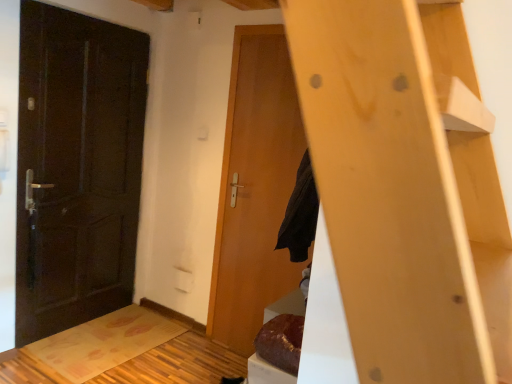
Locate an element on the screen. Image resolution: width=512 pixels, height=384 pixels. vacant space that is in between matte dark brown door at left, which is the 1th door in left-to-right order, and wooden door at center, which is counted as the 1th door, starting from the right is located at coordinates (150, 342).